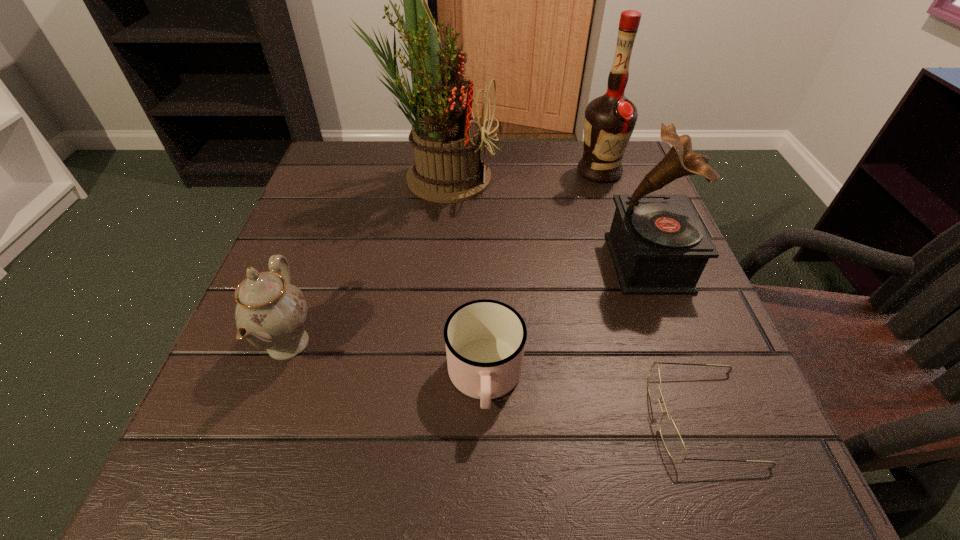
The image size is (960, 540). What are the coordinates of `object located in the near edge section of the desktop` in the screenshot? It's located at (672, 440).

The width and height of the screenshot is (960, 540). In order to click on flower arrangement located at the left edge in this screenshot , I will do `click(446, 139)`.

The height and width of the screenshot is (540, 960). Identify the location of chinaware at the left edge. [x=270, y=313].

Image resolution: width=960 pixels, height=540 pixels. What are the coordinates of `liquor at the right edge` in the screenshot? It's located at (609, 120).

At what (x,y) coordinates should I click in order to perform the action: click on phonograph_record that is at the right edge. Please return your answer as a coordinate pair (x, y). This screenshot has height=540, width=960. Looking at the image, I should click on (659, 246).

Find the location of a particular element. spectacles that is at the right edge is located at coordinates (672, 440).

You are a GUI agent. You are given a task and a screenshot of the screen. Output one action in this format:
    pyautogui.click(x=<x>, y=<y>)
    Task: Click on the object at the far left corner
    
    Given the screenshot: What is the action you would take?
    pyautogui.click(x=446, y=139)

In order to click on object at the far right corner in this screenshot , I will do `click(609, 120)`.

Find the location of a particular element. The height and width of the screenshot is (540, 960). object present at the near right corner is located at coordinates (672, 440).

At what (x,y) coordinates should I click in order to perform the action: click on vacant position at the near edge of the desktop. Please return your answer as a coordinate pair (x, y). The width and height of the screenshot is (960, 540). Looking at the image, I should click on (444, 476).